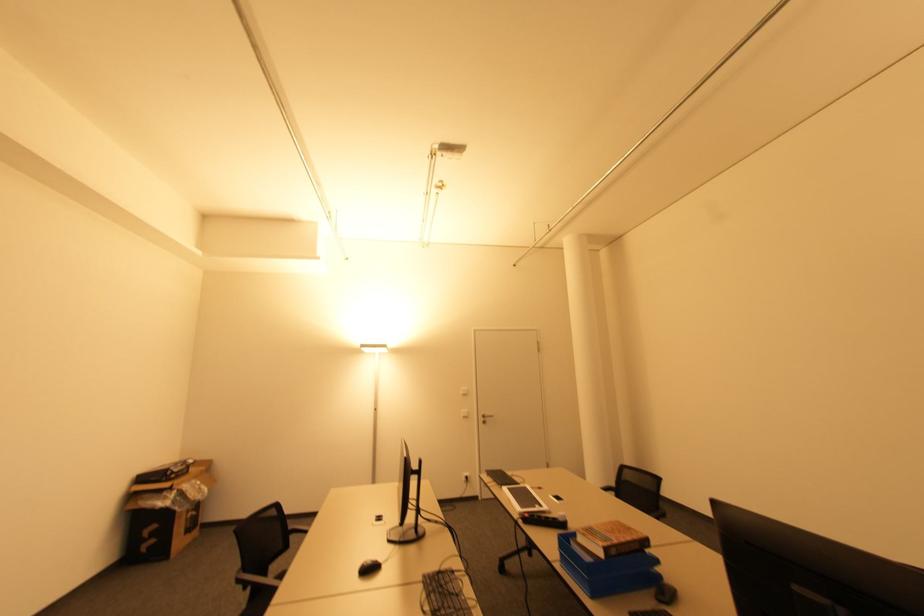
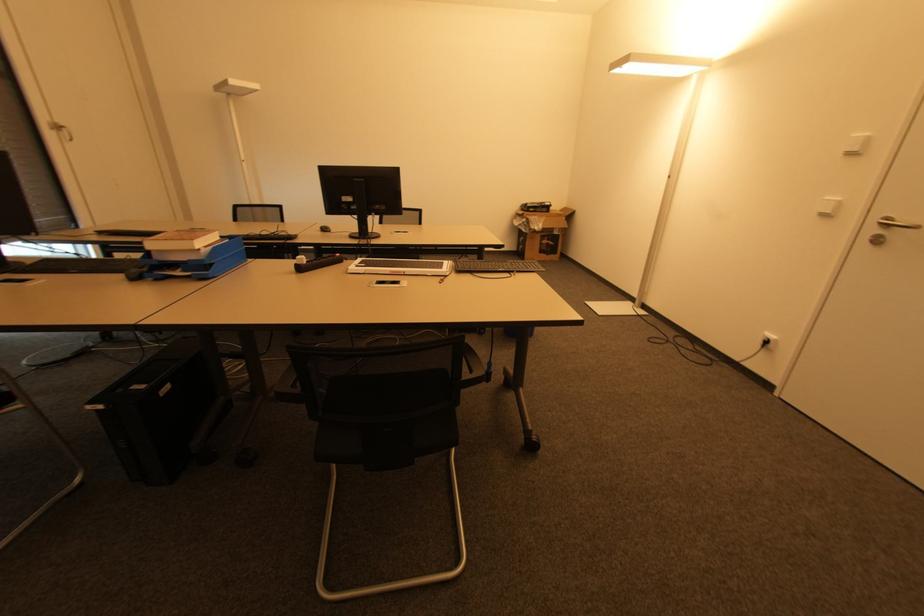
In the second image, find the point that corresponds to (x=195, y=516) in the first image.

(550, 245)